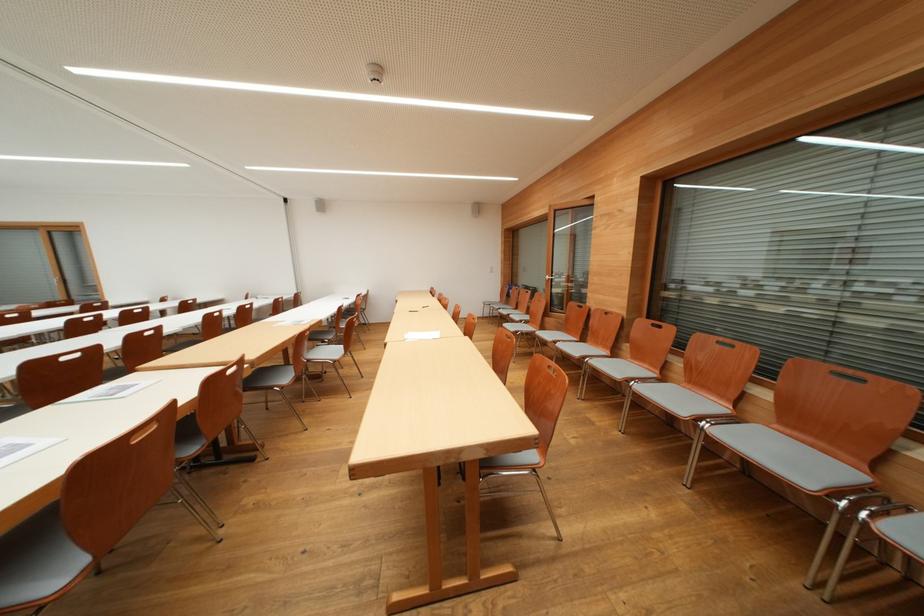
What do you see at coordinates (553, 277) in the screenshot? I see `the silver door handle` at bounding box center [553, 277].